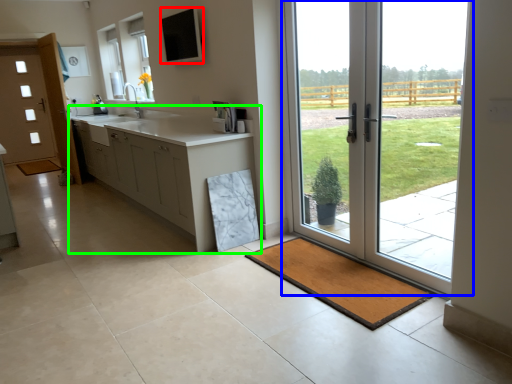
Question: Based on their relative distances, which object is farther from window screen (highlighted by a red box)? Choose from door (highlighted by a blue box) and cabinetry (highlighted by a green box).

Choices:
 (A) door
 (B) cabinetry

Answer: (A)